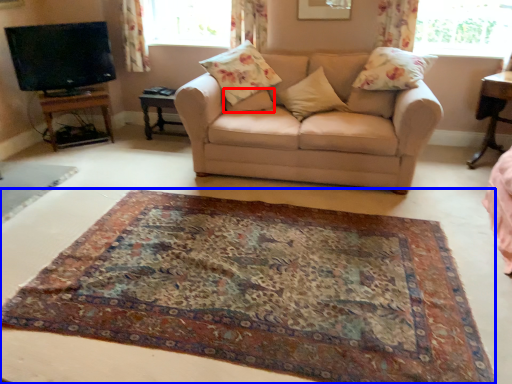
Question: Which of the following is the farthest to the observer, pillow (highlighted by a red box) or mat (highlighted by a blue box)?

Choices:
 (A) pillow
 (B) mat

Answer: (A)